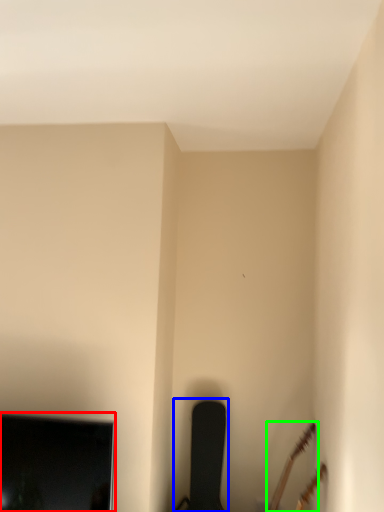
Question: Considering the real-world distances, which object is closest to television (highlighted by a red box)? chair (highlighted by a blue box) or guitar (highlighted by a green box).

Choices:
 (A) chair
 (B) guitar

Answer: (A)